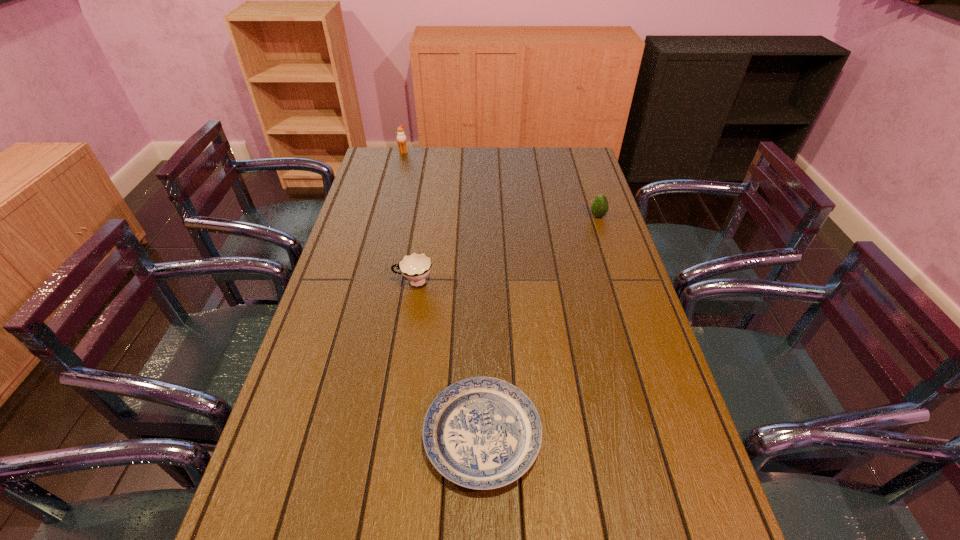
Identify the location of free space located 0.160m on the side of the cup with the handle. (341, 282).

At what (x,y) coordinates should I click in order to perform the action: click on vacant point located on the side of the cup with the handle. Please return your answer as a coordinate pair (x, y). Image resolution: width=960 pixels, height=540 pixels. Looking at the image, I should click on (334, 282).

This screenshot has height=540, width=960. I want to click on free space located on the side of the cup with the handle, so coord(377,282).

This screenshot has width=960, height=540. I want to click on vacant region located on the right of the nearest object, so click(x=643, y=436).

Where is `object present at the far edge`? The height and width of the screenshot is (540, 960). object present at the far edge is located at coordinates (401, 137).

Image resolution: width=960 pixels, height=540 pixels. Find the location of `object that is at the left edge`. object that is at the left edge is located at coordinates (401, 137).

Where is `object that is at the right edge`? object that is at the right edge is located at coordinates (599, 208).

The height and width of the screenshot is (540, 960). What are the coordinates of `object positioned at the far left corner` in the screenshot? It's located at (401, 137).

Image resolution: width=960 pixels, height=540 pixels. Identify the location of free region at the far edge. (524, 156).

Locate an element on the screen. The height and width of the screenshot is (540, 960). vacant area at the left edge is located at coordinates (301, 363).